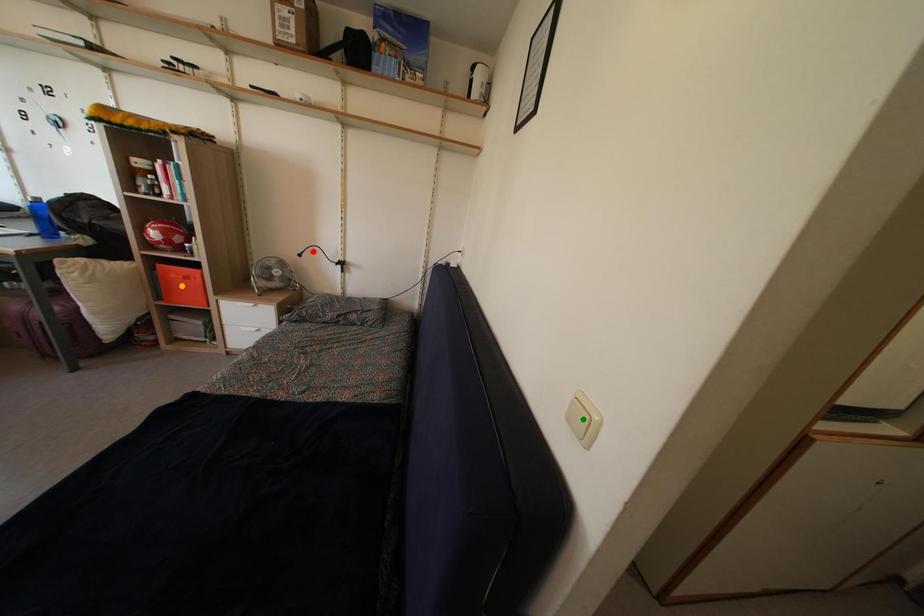
Order these from nearest to farthest:
orange point | red point | green point

red point → orange point → green point